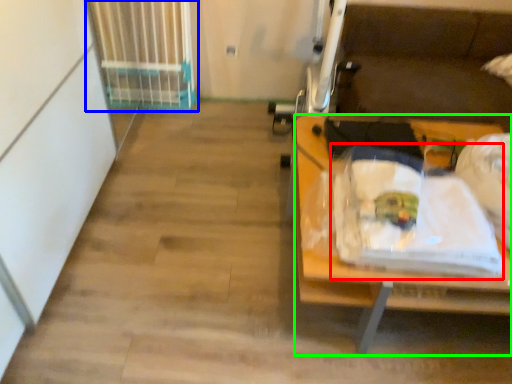
Question: Based on their relative distances, which object is nearer to waste (highlighted by a red box)? Choose from radiator (highlighted by a blue box) and desk (highlighted by a green box).

Choices:
 (A) radiator
 (B) desk

Answer: (B)